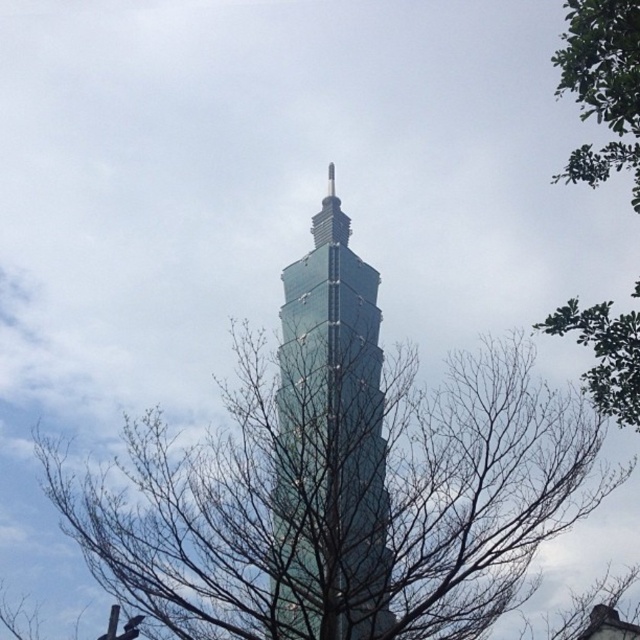
You are an urban planner analyzing the image of the skyscraper. You notice the bare branches at center and the green leafy tree at upper right. Which object is positioned higher in the frame?

The green leafy tree at upper right is positioned higher in the frame than the bare branches at center.

You are standing in front of the skyscraper and notice two points marked on the glass facade. The first point is at coordinates point (292, 502) and the second at point (624, 417). If you want to clean the point closer to you, which coordinate should you target?

You should target point (292, 502) because it is closer to you than point (624, 417).